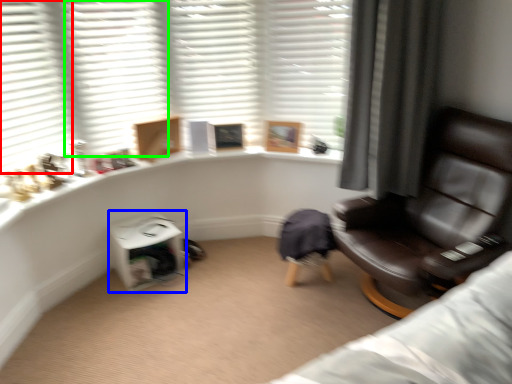
Question: Which object is positioned farthest from shutter (highlighted by a red box)? Select from table (highlighted by a blue box) and shutter (highlighted by a green box).

Choices:
 (A) table
 (B) shutter

Answer: (A)